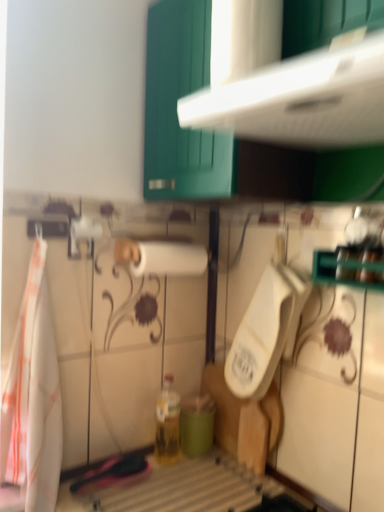
Question: Should I look upward or downward to see white plastic cabinet at upper center?

Choices:
 (A) down
 (B) up

Answer: (B)

Question: Is white plastic cabinet at upper center facing away from white plastic urinal at center?

Choices:
 (A) yes
 (B) no

Answer: (B)

Question: Does white plastic cabinet at upper center have a larger size compared to white plastic urinal at center?

Choices:
 (A) yes
 (B) no

Answer: (A)

Question: Is white plastic cabinet at upper center to the right of white plastic urinal at center from the viewer's perspective?

Choices:
 (A) no
 (B) yes

Answer: (B)

Question: From a real-world perspective, is white plastic cabinet at upper center positioned over white plastic urinal at center based on gravity?

Choices:
 (A) yes
 (B) no

Answer: (A)

Question: Would you consider white plastic cabinet at upper center to be distant from white plastic urinal at center?

Choices:
 (A) no
 (B) yes

Answer: (A)

Question: From the image's perspective, is white plastic cabinet at upper center above white plastic urinal at center?

Choices:
 (A) no
 (B) yes

Answer: (B)

Question: Can you confirm if white fabric towel at left is thinner than teal matte cup at lower center?

Choices:
 (A) yes
 (B) no

Answer: (B)

Question: Is white fabric towel at left oriented away from teal matte cup at lower center?

Choices:
 (A) no
 (B) yes

Answer: (A)

Question: Is teal matte cup at lower center inside white fabric towel at left?

Choices:
 (A) no
 (B) yes

Answer: (A)

Question: From the image's perspective, is white fabric towel at left above teal matte cup at lower center?

Choices:
 (A) yes
 (B) no

Answer: (A)

Question: Does white fabric towel at left have a greater height compared to teal matte cup at lower center?

Choices:
 (A) no
 (B) yes

Answer: (B)

Question: Is white fabric towel at left far from teal matte cup at lower center?

Choices:
 (A) no
 (B) yes

Answer: (A)

Question: From a real-world perspective, does white matte paper towel at center stand above teal matte cup at lower center?

Choices:
 (A) no
 (B) yes

Answer: (B)